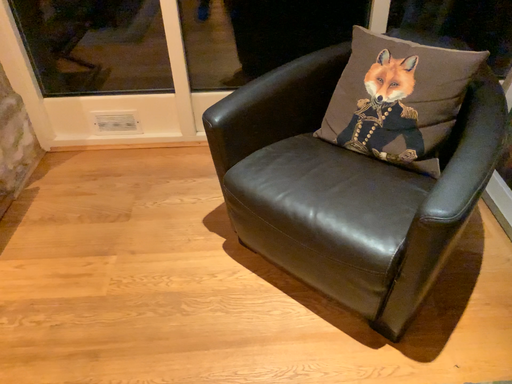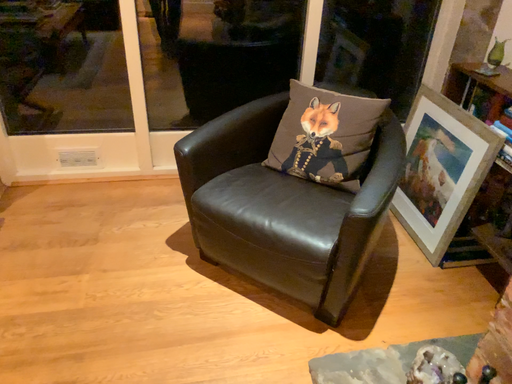
Question: Which way did the camera rotate in the video?

Choices:
 (A) rotated right
 (B) rotated left

Answer: (A)